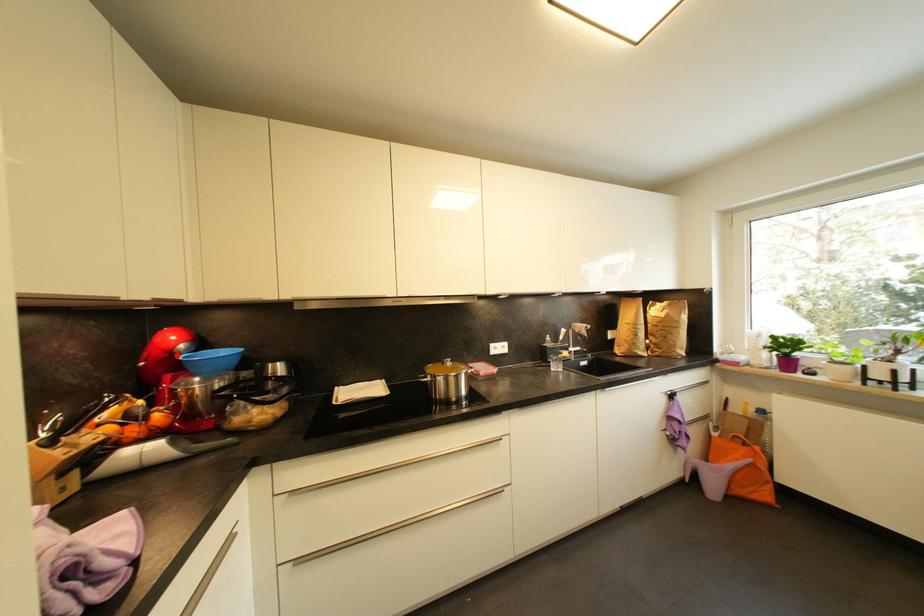
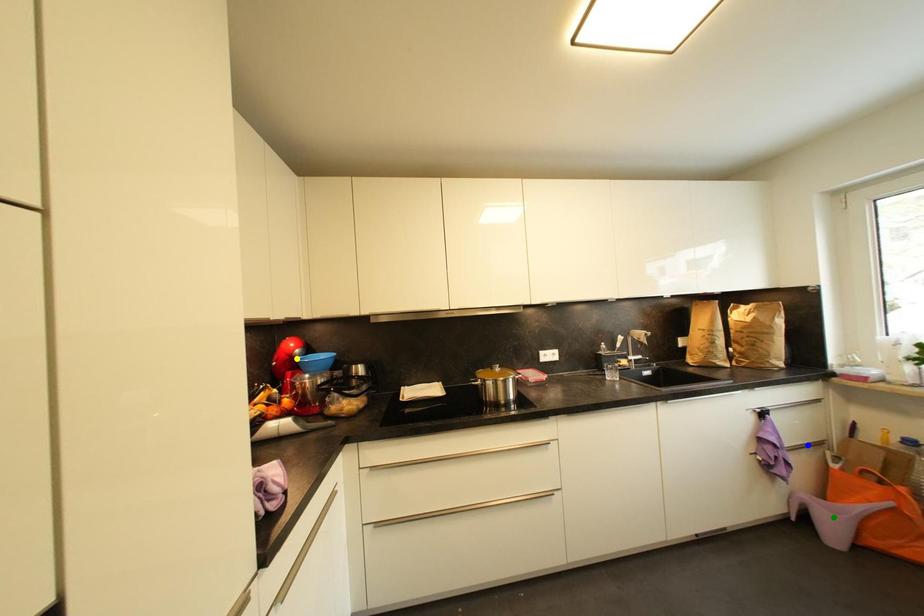
Question: I am providing you with two images of the same scene from different viewpoints. A red point is marked on the first image. You are given multiple points on the second image. Which point in image 2 represents the same 3d spot as the red point in image 1?

Choices:
 (A) green point
 (B) blue point
 (C) yellow point

Answer: (C)